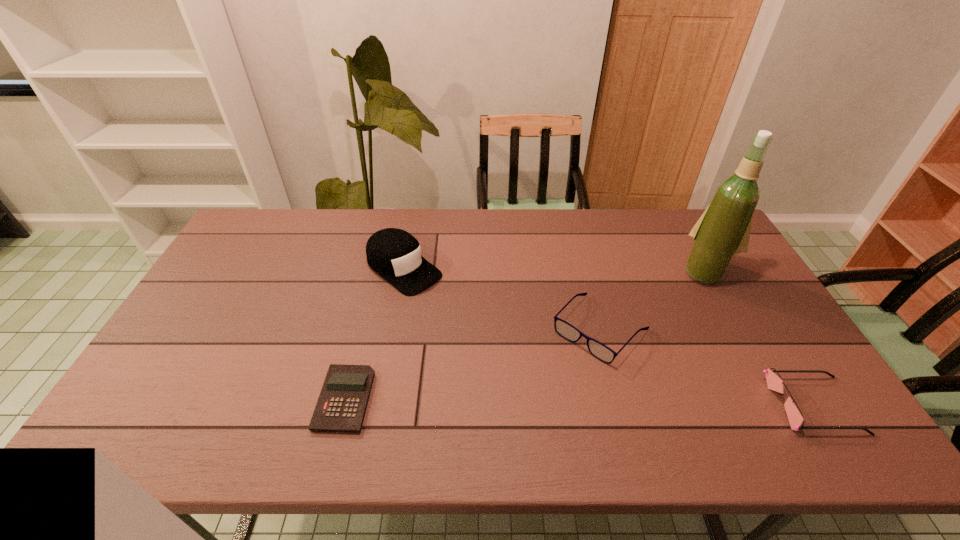
Locate an element on the screen. The image size is (960, 540). vacant space positioned on the front-facing side of the cap is located at coordinates (492, 336).

The image size is (960, 540). In order to click on free location located on the front-facing side of the cap in this screenshot , I will do `click(458, 310)`.

The height and width of the screenshot is (540, 960). Identify the location of free space located 0.170m on the front-facing side of the third object from left to right. (536, 400).

You are a GUI agent. You are given a task and a screenshot of the screen. Output one action in this format:
    pyautogui.click(x=<x>, y=<y>)
    Task: Click on the free spot located on the front-facing side of the third object from left to right
    
    Given the screenshot: What is the action you would take?
    pyautogui.click(x=556, y=377)

In order to click on free region located on the front-facing side of the third object from left to right in this screenshot , I will do `click(549, 384)`.

Where is `object positioned at the far edge`? object positioned at the far edge is located at coordinates (394, 254).

I want to click on calculator at the near edge, so click(x=341, y=407).

Where is `sunglasses that is at the near edge`? sunglasses that is at the near edge is located at coordinates (775, 383).

The width and height of the screenshot is (960, 540). In order to click on sunglasses present at the right edge in this screenshot , I will do `click(775, 383)`.

In order to click on wine bottle situated at the right edge in this screenshot , I will do `click(723, 230)`.